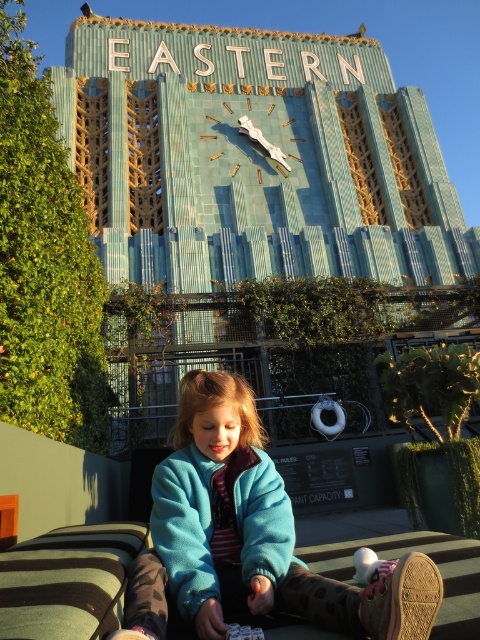
You are standing in front of the Art Deco building and want to place a small flower pot between the two points marked as point (265, 529) and point (286, 177). Since you want the flower pot to be closer to you, which point should you position it near?

To place the flower pot closer to you, position it near point (265, 529) because it is closer to the viewer than point (286, 177).

You are a tailor measuring the blue fleece jacket at center and the silver metallic clock at upper center for a custom fit. Which item has a smaller width?

The blue fleece jacket at center is thinner than the silver metallic clock at upper center, so the blue fleece jacket at center has a smaller width.